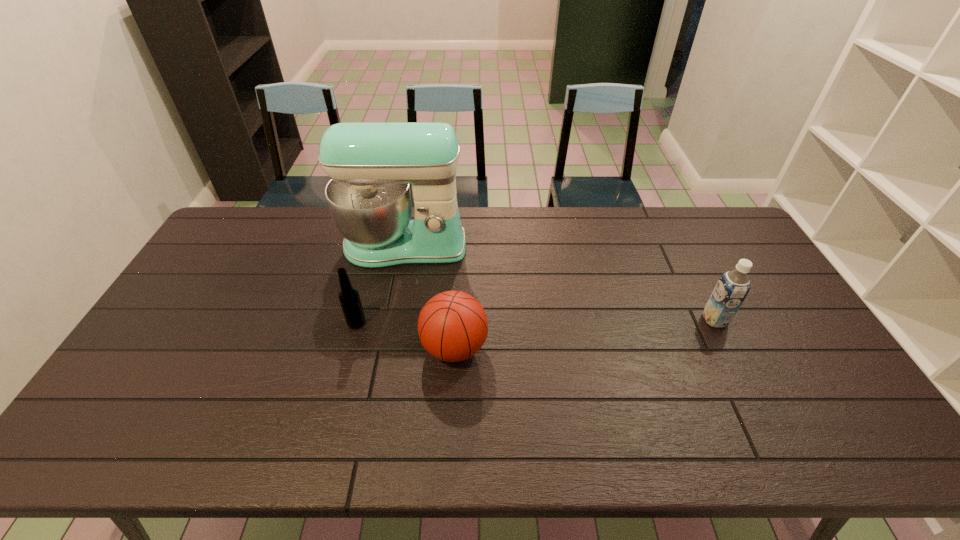
The image size is (960, 540). Find the location of `vacant space located on the back of the basketball`. vacant space located on the back of the basketball is located at coordinates (457, 293).

What are the coordinates of `object that is at the far edge` in the screenshot? It's located at click(371, 165).

The height and width of the screenshot is (540, 960). In the image, there is a desktop. In order to click on vacant space at the far edge in this screenshot , I will do `click(639, 239)`.

At what (x,y) coordinates should I click in order to perform the action: click on free space at the near edge. Please return your answer as a coordinate pair (x, y). This screenshot has height=540, width=960. Looking at the image, I should click on (528, 426).

At what (x,y) coordinates should I click in order to perform the action: click on free location at the left edge of the desktop. Please return your answer as a coordinate pair (x, y). The width and height of the screenshot is (960, 540). Looking at the image, I should click on (254, 248).

At what (x,y) coordinates should I click in order to perform the action: click on free region at the right edge. Please return your answer as a coordinate pair (x, y). Looking at the image, I should click on (797, 358).

What are the coordinates of `vacant space at the far left corner` in the screenshot? It's located at (236, 235).

Identify the location of free space at the far right corner of the desktop. The height and width of the screenshot is (540, 960). (706, 222).

Identify the location of free space between the basketball and the beer bottle. (405, 335).

Locate an element on the screen. This screenshot has height=540, width=960. free space between the basketball and the beer bottle is located at coordinates (405, 335).